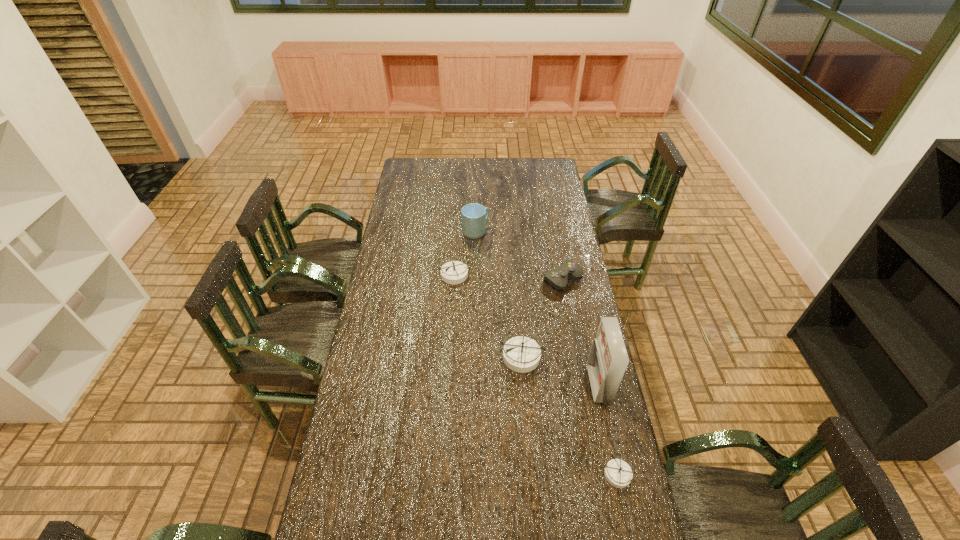
Locate an element on the screen. The image size is (960, 540). the first-aid kit positioned at the right edge is located at coordinates (608, 359).

This screenshot has height=540, width=960. In the image, there is a desktop. Identify the location of vacant space at the far edge. (472, 174).

Locate an element on the screen. The image size is (960, 540). free space at the left edge of the desktop is located at coordinates (398, 260).

Find the location of a particular element. free region at the right edge of the desktop is located at coordinates (553, 230).

You are a GUI agent. You are given a task and a screenshot of the screen. Output one action in this format:
    pyautogui.click(x=<x>, y=<y>)
    Task: Click on the vacant space at the far left corner of the desktop
    Image resolution: width=960 pixels, height=540 pixels.
    Given the screenshot: What is the action you would take?
    pyautogui.click(x=407, y=163)

Identify the location of free space at the far right corner of the desktop. (x=532, y=180).

Locate an element on the screen. The width and height of the screenshot is (960, 540). blank region between the fifth shortest object and the control is located at coordinates (519, 255).

Locate an element on the screen. Image resolution: width=960 pixels, height=540 pixels. empty location between the leftmost compass and the shortest object is located at coordinates (537, 374).

Locate an element on the screen. The image size is (960, 540). empty space that is in between the second tallest object and the tallest object is located at coordinates (537, 308).

Identify the location of unoccupied position between the control and the second farthest compass. The height and width of the screenshot is (540, 960). (542, 318).